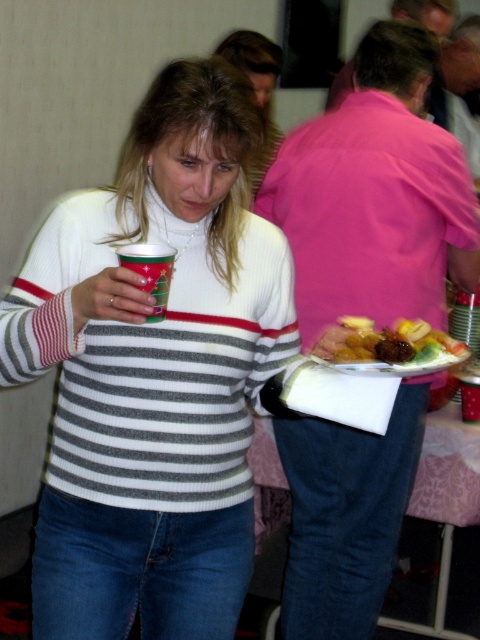
Can you confirm if pink fabric table at lower center is shorter than glossy plastic plate at lower center?

No.

This screenshot has height=640, width=480. What are the coordinates of `pink fabric table at lower center` in the screenshot? It's located at (446, 474).

Where is `pink fabric table at lower center`? This screenshot has height=640, width=480. pink fabric table at lower center is located at coordinates (446, 474).

From the picture: Is white knit sweater at center positioned before pink fabric table at lower center?

Yes, it is.

Does white knit sweater at center have a smaller size compared to pink fabric table at lower center?

Correct, white knit sweater at center occupies less space than pink fabric table at lower center.

Who is more forward, (78,445) or (477,572)?

Point (78,445) is more forward.

At what (x,y) coordinates should I click in order to perform the action: click on white knit sweater at center. Please return your answer as a coordinate pair (x, y). Looking at the image, I should click on (154, 371).

Is point (105, 289) farther from camera compared to point (435, 362)?

No, it is not.

Is white knit sweater at center positioned at the back of glossy plastic plate at lower center?

No, white knit sweater at center is closer to the viewer.

Which is in front, point (152, 387) or point (389, 336)?

Point (389, 336)

The height and width of the screenshot is (640, 480). I want to click on white knit sweater at center, so click(154, 371).